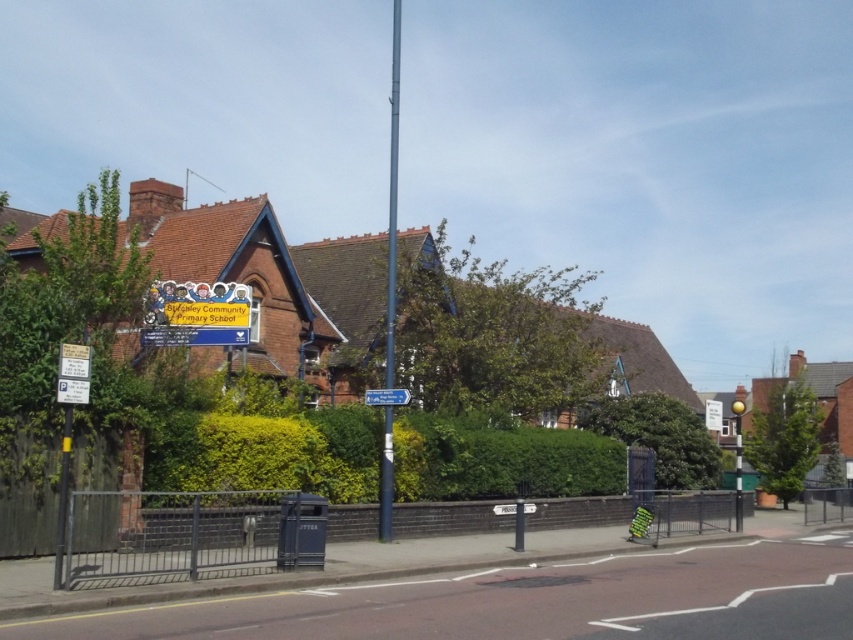
Question: Among these points, which one is farthest from the camera?

Choices:
 (A) (64, 460)
 (B) (532, 506)

Answer: (B)

Question: Which point is closer to the camera taking this photo?

Choices:
 (A) (834, 547)
 (B) (683, 422)

Answer: (A)

Question: Can you confirm if smooth metallic pole at center is positioned to the left of white plastic parking sign at center?

Choices:
 (A) yes
 (B) no

Answer: (A)

Question: Among these points, which one is nearest to the camera?

Choices:
 (A) (59, 493)
 (B) (834, 576)
 (C) (509, 504)
 (D) (662, 440)

Answer: (A)

Question: Can you confirm if smooth asphalt road at lower center is positioned to the right of metallic blue sign at center?

Choices:
 (A) no
 (B) yes

Answer: (B)

Question: In this image, where is metallic pole at left located relative to white plastic parking sign at center?

Choices:
 (A) left
 (B) right

Answer: (A)